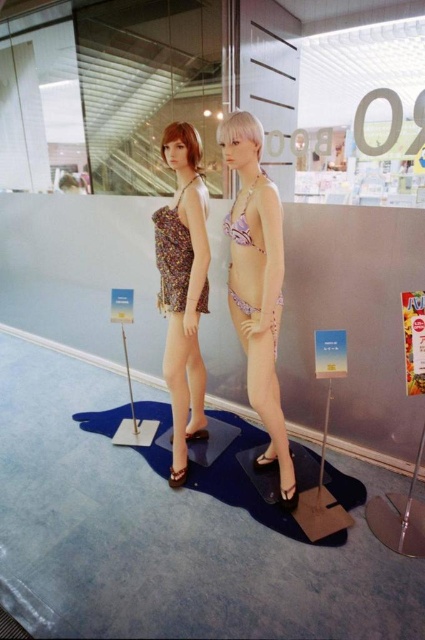
Who is positioned more to the left, pink floral bikini at center or metallic pole at center?

Positioned to the left is pink floral bikini at center.

Does pink floral bikini at center have a greater width compared to metallic pole at center?

Correct, the width of pink floral bikini at center exceeds that of metallic pole at center.

Who is more distant from viewer, [255,392] or [328,412]?

The point [328,412] is behind.

Where is `pink floral bikini at center`? The image size is (425, 640). pink floral bikini at center is located at coordinates (257, 282).

Between transparent glass mannequin at upper center and printed fabric dress at center, which one appears on the left side from the viewer's perspective?

transparent glass mannequin at upper center

Between transparent glass mannequin at upper center and printed fabric dress at center, which one is positioned higher?

transparent glass mannequin at upper center

Which is behind, point (13, 29) or point (153, 218)?

Point (13, 29)

Image resolution: width=425 pixels, height=640 pixels. What are the coordinates of `transparent glass mannequin at upper center` in the screenshot? It's located at (107, 92).

Does transparent glass mannequin at upper center appear under pink satin underwear at center?

No, transparent glass mannequin at upper center is not below pink satin underwear at center.

Is transparent glass mannequin at upper center thinner than pink satin underwear at center?

In fact, transparent glass mannequin at upper center might be wider than pink satin underwear at center.

Between point (8, 113) and point (249, 312), which one is positioned in front?

Point (249, 312)

You are a GUI agent. You are given a task and a screenshot of the screen. Output one action in this format:
    pyautogui.click(x=<x>, y=<y>)
    Task: Click on the transparent glass mannequin at upper center
    This screenshot has width=425, height=640.
    Given the screenshot: What is the action you would take?
    click(x=107, y=92)